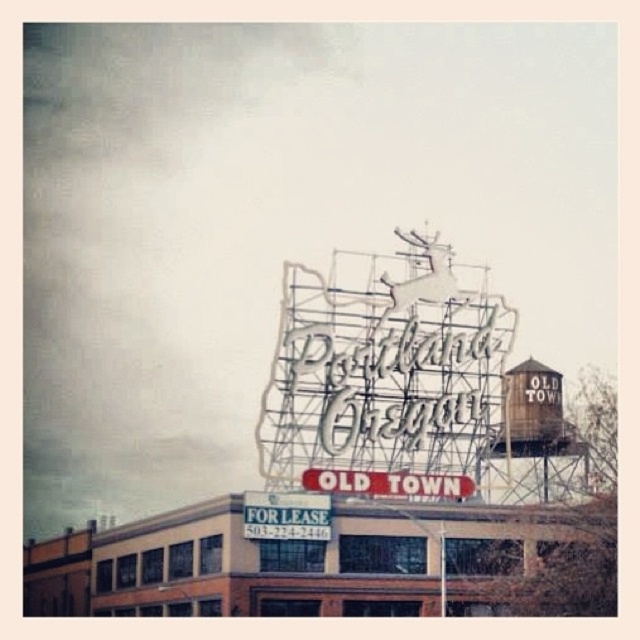
You are a tourist in Old Town and want to take a photo of both the metallic wireframe sign at center and the rustic wooden water tower at upper right. Which object should you position to your left to capture both in the frame?

The metallic wireframe sign at center is to the left of rustic wooden water tower at upper right, so to capture both in the frame, position the metallic wireframe sign at center to your left and the rustic wooden water tower at upper right to your right.

You are standing in front of the building and want to read both the metallic wireframe sign at center and the white metal sign at center. Which sign should you look at first to see the one closer to you?

You should look at the metallic wireframe sign at center first because it is closer to you than the white metal sign at center.

You are standing on the sidewalk in Old Town, Portland, and want to take a photo of the metallic wireframe sign at center. If your camera can focus on objects up to 350 feet away, will you be able to capture a clear image of the sign?

The metallic wireframe sign at center is 349.85 feet away from the viewer. Since the camera can focus up to 350 feet, the distance is within range, so yes, you can capture a clear image of the sign.